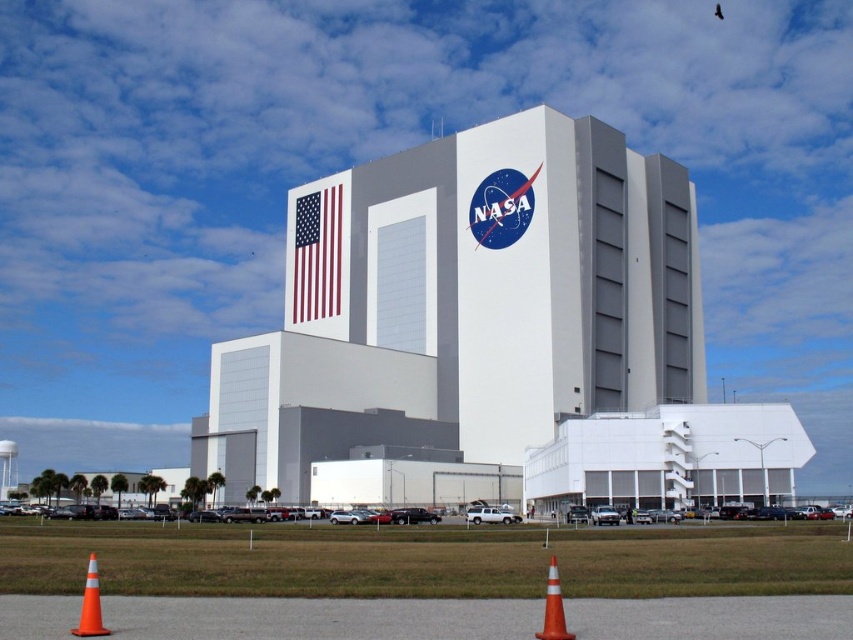
Describe the element at coordinates (316, 252) in the screenshot. This screenshot has width=853, height=640. I see `red fabric flag at upper center` at that location.

Is point (294, 230) positioned after point (48, 508)?

Yes.

What do you see at coordinates (316, 252) in the screenshot?
I see `red fabric flag at upper center` at bounding box center [316, 252].

Locate an element on the screen. red fabric flag at upper center is located at coordinates (316, 252).

Can you confirm if white smooth building at center is positioned to the right of orange plastic traffic cone at lower center?

Incorrect, white smooth building at center is not on the right side of orange plastic traffic cone at lower center.

Who is more forward, (598, 122) or (572, 636)?

Point (572, 636)

Between point (537, 198) and point (546, 637), which one is positioned behind?

Point (537, 198)

At what (x,y) coordinates should I click in order to perform the action: click on white smooth building at center. Please return your answer as a coordinate pair (x, y). This screenshot has width=853, height=640. Looking at the image, I should click on (473, 308).

Who is taller, orange reflective cone at lower left or orange plastic traffic cone at lower center?

orange reflective cone at lower left is taller.

Does orange reflective cone at lower left have a lesser width compared to orange plastic traffic cone at lower center?

Incorrect, orange reflective cone at lower left's width is not less than orange plastic traffic cone at lower center's.

I want to click on orange reflective cone at lower left, so click(90, 604).

Image resolution: width=853 pixels, height=640 pixels. In order to click on orange reflective cone at lower left in this screenshot , I will do `click(90, 604)`.